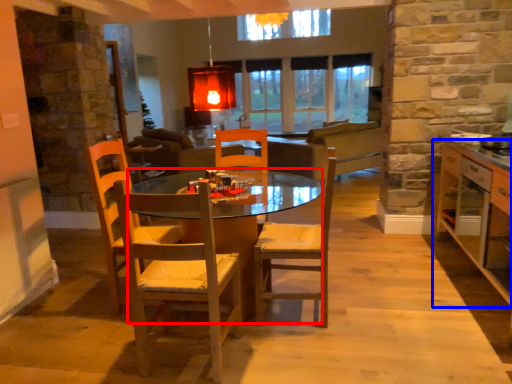
Question: Which of the following is the closest to the observer, desk (highlighted by a red box) or cabinetry (highlighted by a blue box)?

Choices:
 (A) desk
 (B) cabinetry

Answer: (B)